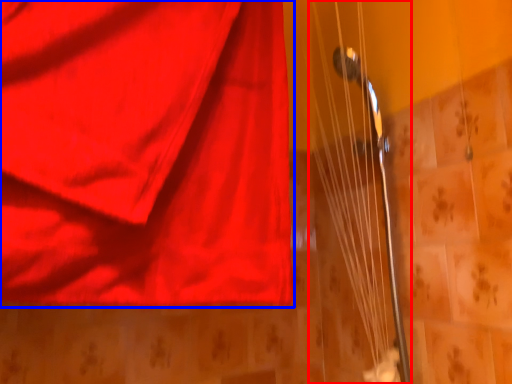
Question: Which point is closer to the camera, string (highlighted by a red box) or curtain (highlighted by a blue box)?

Choices:
 (A) string
 (B) curtain

Answer: (B)